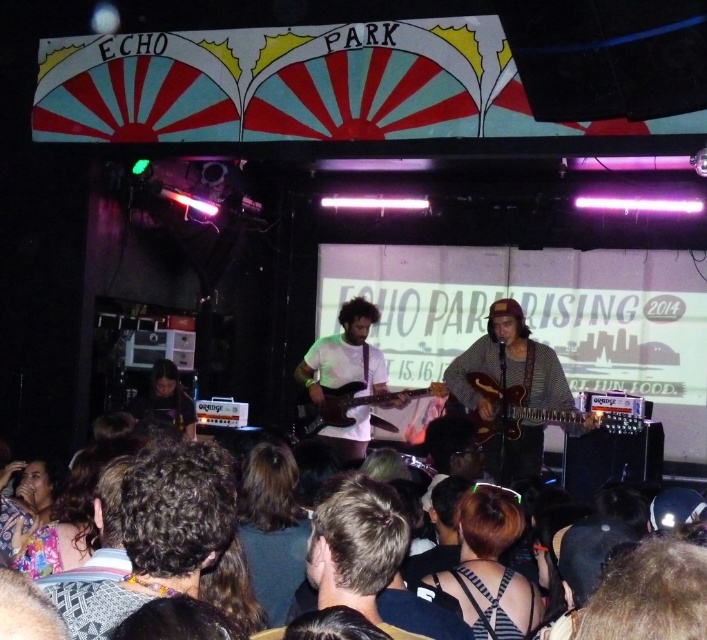
Based on the photo, you are a photographer at Echo Park venue and want to capture a closeup of the curly hair at lower left. The camera you are using has a focus point set at coordinate point (x=158, y=532). Will this focus point be effective for capturing the curly hair?

Yes, the focus point at (x=158, y=532) is on the curly hair at lower left, so it will effectively capture the curly hair.

You are a photographer setting up equipment in the middle of the stage. You have two guitars, the wooden guitar at center and the white matte guitar at center. Which guitar do you need to move if you want to make space for a wider microphone stand that requires more room than the existing guitars? Explain your reasoning.

The wooden guitar at center is wider than the white matte guitar at center. Since the microphone stand requires more room than the existing guitars, you should move the wooden guitar at center because it occupies more space due to its greater width.